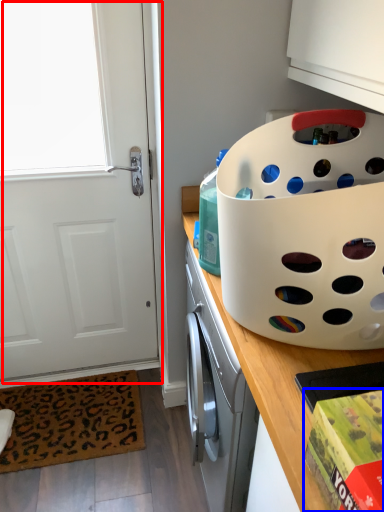
Question: Which object is closer to the camera taking this photo, door (highlighted by a red box) or box (highlighted by a blue box)?

Choices:
 (A) door
 (B) box

Answer: (B)